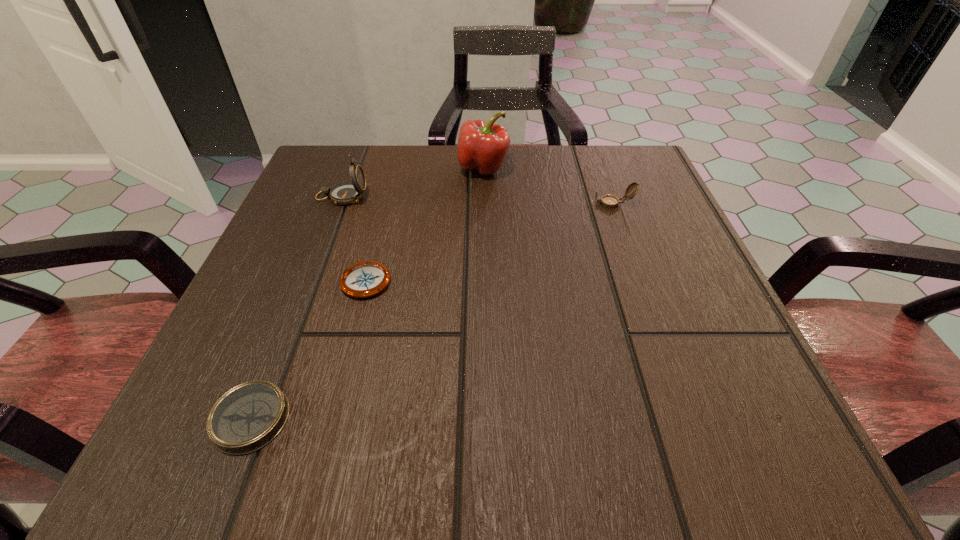
You are a GUI agent. You are given a task and a screenshot of the screen. Output one action in this format:
    pyautogui.click(x=<x>, y=<y>)
    Task: Click on the farthest object
    Image resolution: width=960 pixels, height=540 pixels.
    Given the screenshot: What is the action you would take?
    pyautogui.click(x=482, y=147)

At what (x,y) coordinates should I click in order to perform the action: click on the second object from right to left. Please return your answer as a coordinate pair (x, y). The height and width of the screenshot is (540, 960). Looking at the image, I should click on (482, 147).

The height and width of the screenshot is (540, 960). Find the location of `the fourth shortest object`. the fourth shortest object is located at coordinates (345, 193).

This screenshot has width=960, height=540. Find the location of `the rightmost compass`. the rightmost compass is located at coordinates (608, 201).

You are a GUI agent. You are given a task and a screenshot of the screen. Output one action in this format:
    pyautogui.click(x=<x>, y=<y>)
    Task: Click on the rightmost object
    
    Given the screenshot: What is the action you would take?
    pyautogui.click(x=608, y=201)

I want to click on the second nearest compass, so click(365, 279).

At what (x,y) coordinates should I click in order to perform the action: click on the third object from left to right. Please return your answer as a coordinate pair (x, y). The height and width of the screenshot is (540, 960). Looking at the image, I should click on (365, 279).

Identify the location of the nearest compass. This screenshot has width=960, height=540. (246, 418).

Identify the location of free spot located on the front of the pepper. This screenshot has height=540, width=960. (484, 205).

Where is `free space located 0.350m on the face of the tallest compass`? free space located 0.350m on the face of the tallest compass is located at coordinates (541, 197).